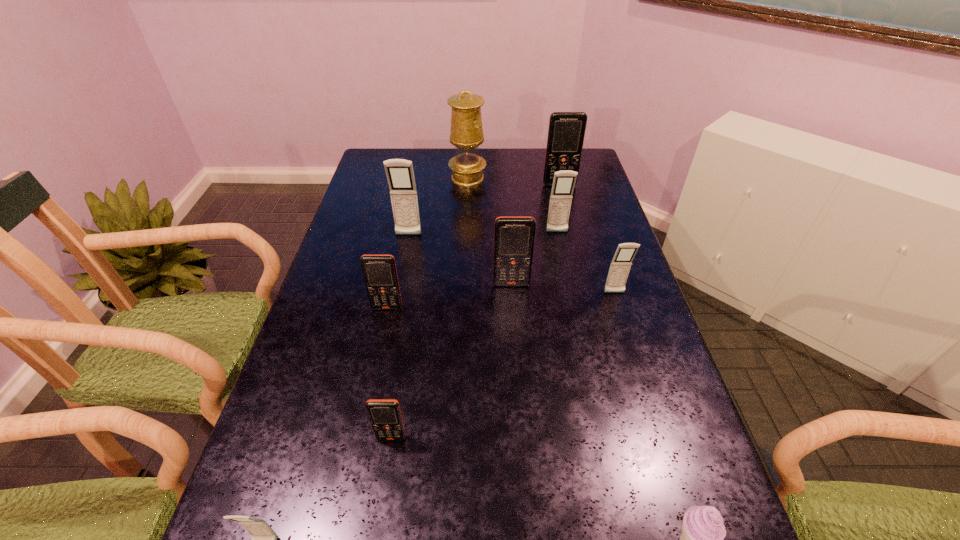
Image resolution: width=960 pixels, height=540 pixels. I want to click on free space located 0.350m on the screen of the fourth nearest object, so click(x=360, y=439).

Find the location of `free space located on the screen of the nearest orange cellular telephone`. free space located on the screen of the nearest orange cellular telephone is located at coordinates (377, 529).

The image size is (960, 540). I want to click on object that is at the far edge, so click(x=466, y=134).

What are the coordinates of `object positioned at the left edge` in the screenshot? It's located at (379, 271).

Image resolution: width=960 pixels, height=540 pixels. I want to click on free space at the far edge of the desktop, so click(452, 154).

Locate an element on the screen. The width and height of the screenshot is (960, 540). vacant point at the left edge is located at coordinates (368, 180).

This screenshot has width=960, height=540. Identify the location of free space at the right edge of the desktop. (661, 474).

Identify the location of free spot at the far left corner of the desktop. click(388, 153).

Locate an element on the screen. The height and width of the screenshot is (540, 960). vacant space that's between the fifth nearest object and the third gray cellular telephone from left to right is located at coordinates (586, 262).

Where is `empty space between the farthest orange cellular telephone and the third smallest orange cellular telephone`? The image size is (960, 540). empty space between the farthest orange cellular telephone and the third smallest orange cellular telephone is located at coordinates (536, 234).